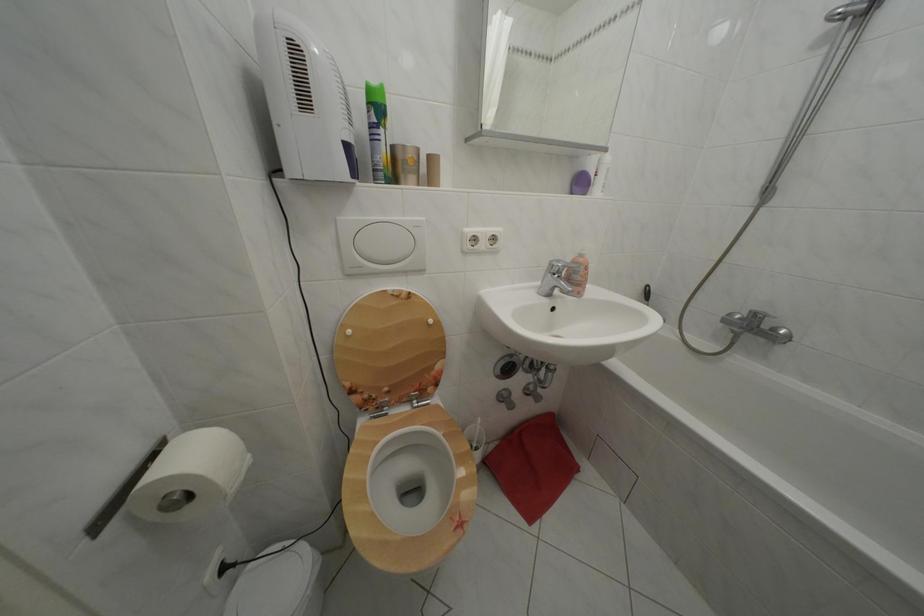
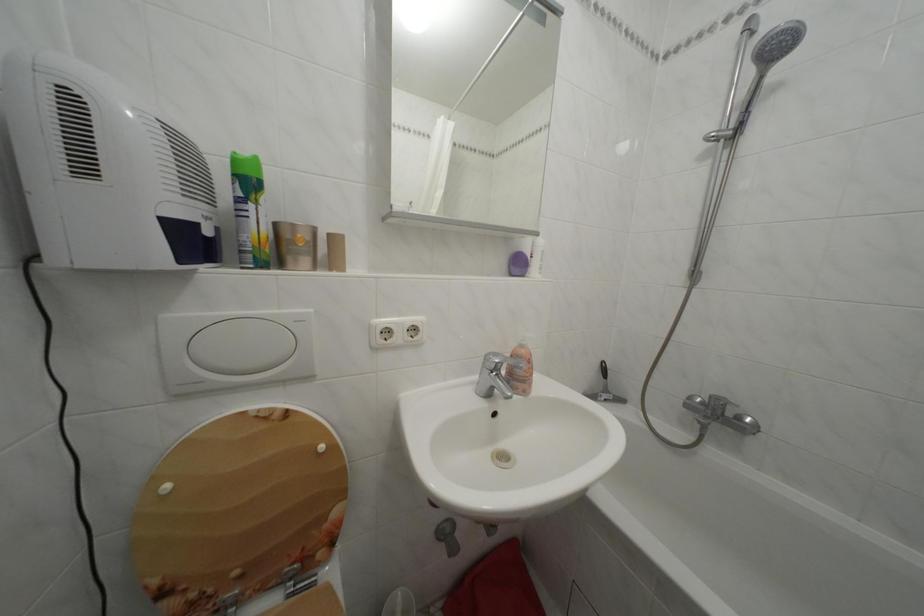
The images are taken continuously from a first-person perspective. In which direction are you moving?

The movement direction of the cameraman is right, forward.